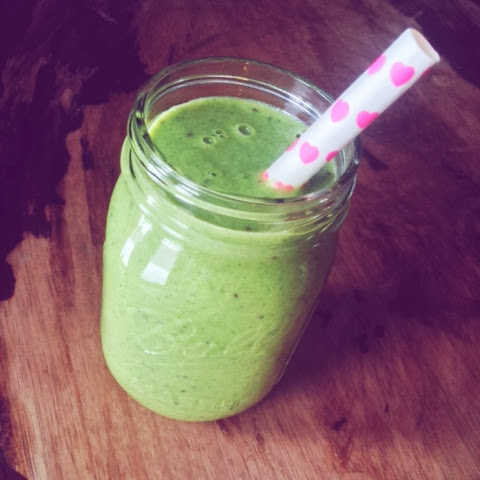
This screenshot has height=480, width=480. I want to click on ball jar, so click(x=242, y=291), click(x=242, y=204), click(x=305, y=92), click(x=342, y=159).